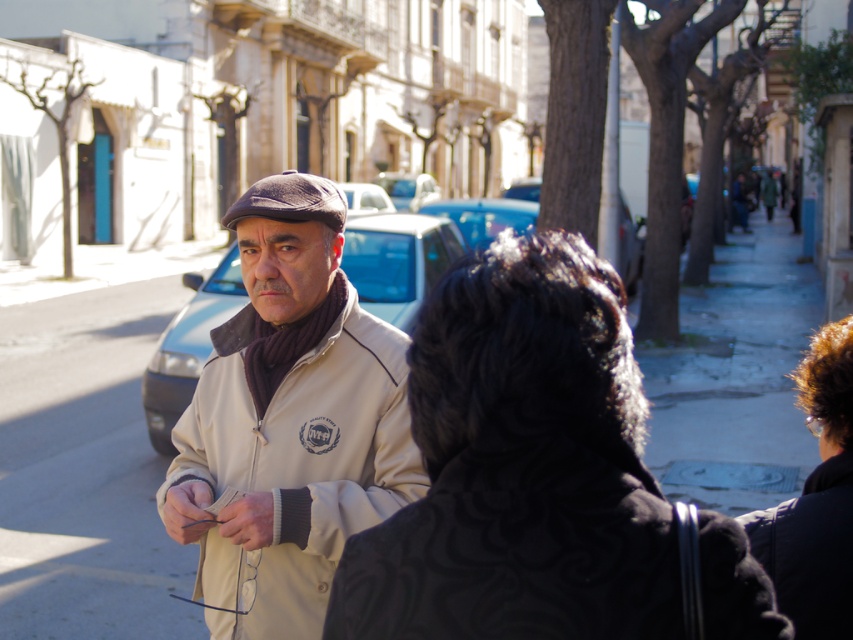
Based on the scene description, which object is taller between the dark brown hair at lower right and the matte blue car at center?

The dark brown hair at lower right is taller than the matte blue car at center.

You are a photographer trying to capture a candid shot of the dark brown hair at lower right without the subject noticing. The black textured coat at center is blocking your view. Based on their positions, can you move to the right to get a clear shot?

The black textured coat at center is to the left of dark brown hair at lower right, so moving to the right would place you further away from the obstruction. Instead, moving to the left might allow you to see around the black textured coat at center and capture the dark brown hair at lower right without being noticed.